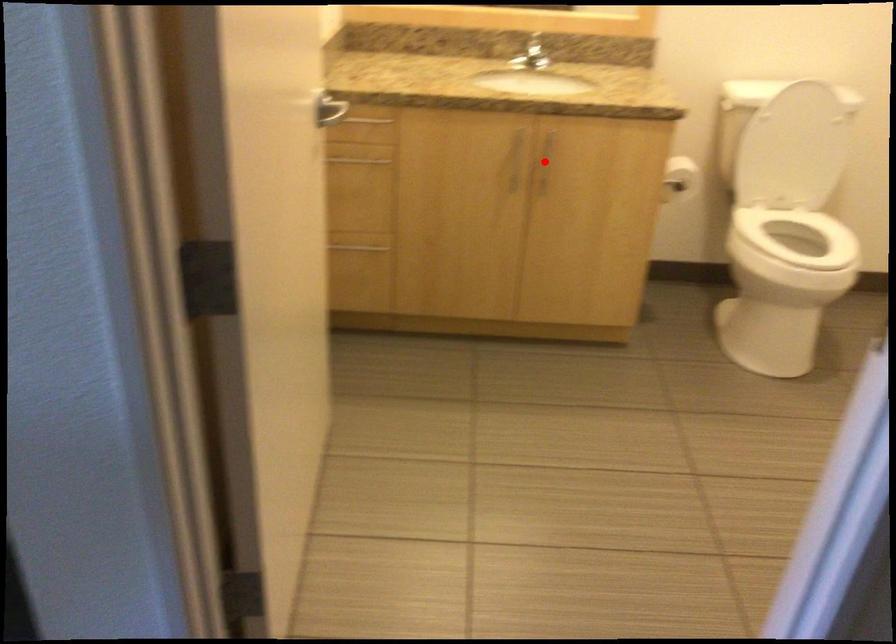
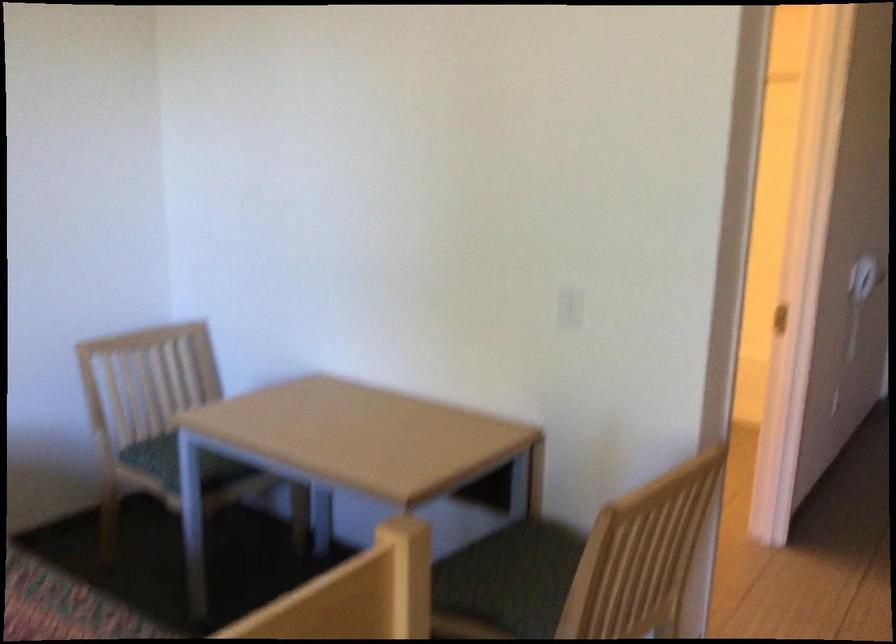
Question: I am providing you with two images of the same scene from different viewpoints. A red point is marked on the first image. Is the red point's position out of view in image 2?

Choices:
 (A) Yes
 (B) No

Answer: (A)